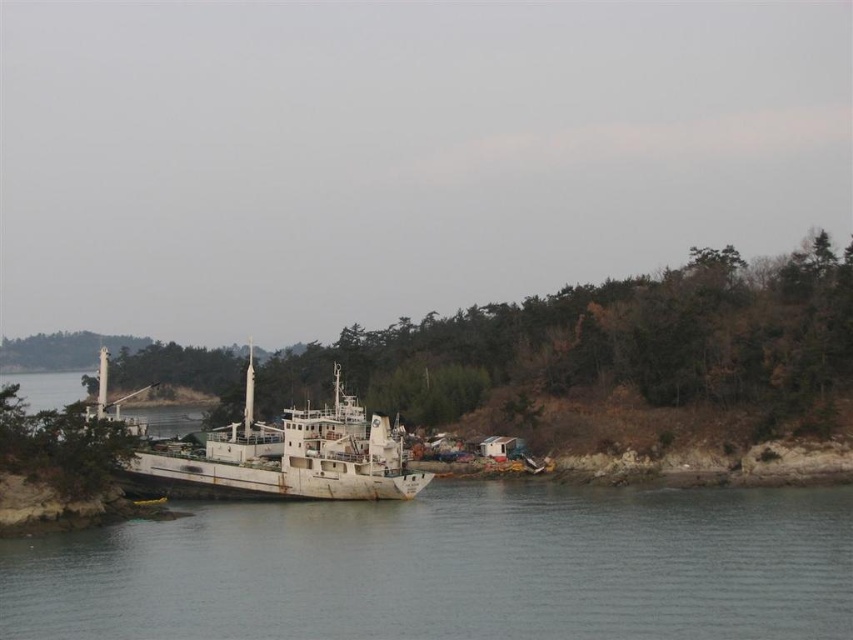
Question: Among these objects, which one is nearest to the camera?

Choices:
 (A) rusty metal boat at center
 (B) rusty metallic water at lower center

Answer: (B)

Question: In this image, where is rusty metallic water at lower center located relative to rusty metal boat at center?

Choices:
 (A) right
 (B) left

Answer: (A)

Question: Which object is farther from the camera taking this photo?

Choices:
 (A) rusty metallic water at lower center
 (B) rusty metal boat at center

Answer: (B)

Question: Is rusty metallic water at lower center to the left of rusty metal boat at center from the viewer's perspective?

Choices:
 (A) no
 (B) yes

Answer: (A)

Question: Does rusty metallic water at lower center appear under rusty metal boat at center?

Choices:
 (A) no
 (B) yes

Answer: (B)